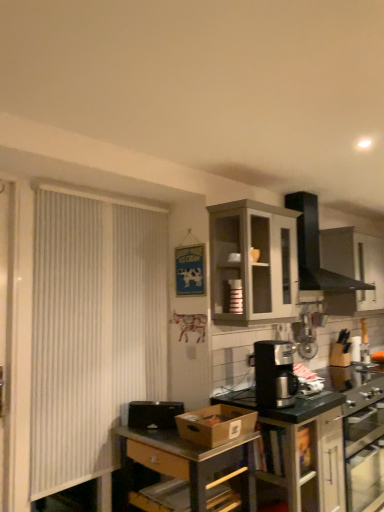
Image resolution: width=384 pixels, height=512 pixels. I want to click on free space in front of black plastic bowl at center, so click(155, 434).